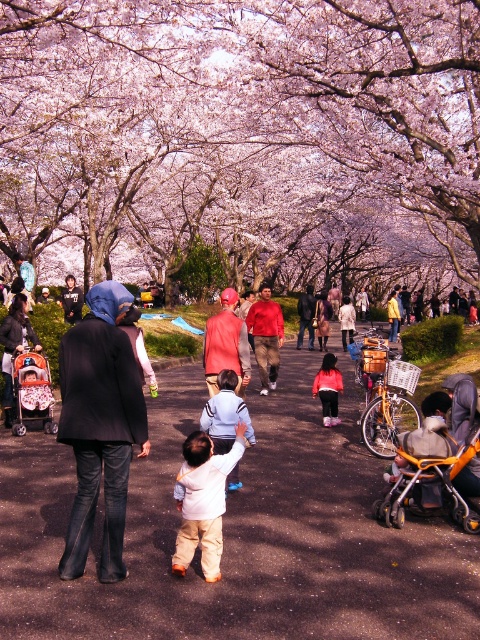
Question: Estimate the real-world distances between objects in this image. Which object is closer to the light blue sweater at center?

Choices:
 (A) polka dot fabric baby carriage at left
 (B) smooth asphalt path at center

Answer: (B)

Question: Which point is farther to the camera?

Choices:
 (A) orange plastic baby carriage at lower right
 (B) pink blossom tree at center
 (C) denim jacket at left
 (D) smooth asphalt path at center

Answer: (B)

Question: Is the position of pink blossom tree at center more distant than that of polka dot fabric baby carriage at left?

Choices:
 (A) yes
 (B) no

Answer: (A)

Question: Which object is farther from the camera taking this photo?

Choices:
 (A) smooth asphalt path at center
 (B) orange fleece jacket at center
 (C) orange plastic baby carriage at lower right

Answer: (B)

Question: Can you confirm if orange plastic baby carriage at lower right is wider than orange fleece jacket at center?

Choices:
 (A) yes
 (B) no

Answer: (A)

Question: Does light beige pants at center have a lesser width compared to polka dot fabric baby carriage at left?

Choices:
 (A) yes
 (B) no

Answer: (A)